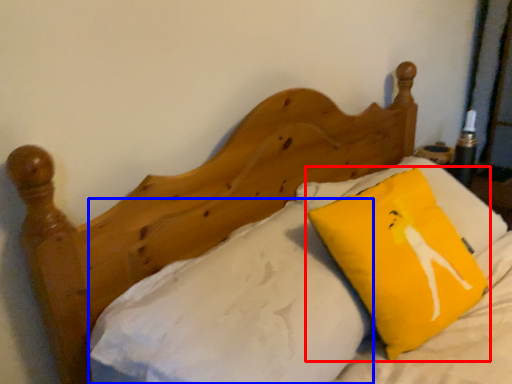
Question: Which object appears closest to the camera in this image, pillow (highlighted by a red box) or sheet (highlighted by a blue box)?

Choices:
 (A) pillow
 (B) sheet

Answer: (B)